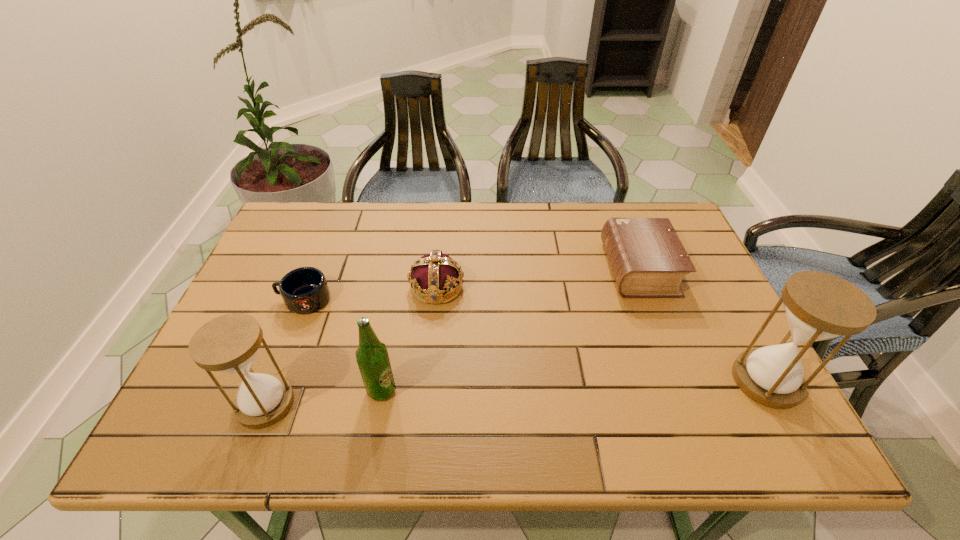
Find the location of `vacant space situated 0.260m on the left of the third shortest object`. vacant space situated 0.260m on the left of the third shortest object is located at coordinates (313, 287).

The image size is (960, 540). I want to click on vacant space positioned 0.360m on the spine side of the fifth tallest object, so click(x=479, y=269).

You are a GUI agent. You are given a task and a screenshot of the screen. Output one action in this format:
    pyautogui.click(x=<x>, y=<y>)
    Task: Click on the vacant space located on the spine side of the fifth tallest object
    Image resolution: width=960 pixels, height=540 pixels.
    Given the screenshot: What is the action you would take?
    pyautogui.click(x=521, y=269)

The image size is (960, 540). What are the coordinates of `blank space located 0.120m on the spine side of the fifth tallest object` in the screenshot? It's located at (564, 269).

Find the location of `free location located with the handle on the side of the shortest object`. free location located with the handle on the side of the shortest object is located at coordinates (255, 299).

Locate an element on the screen. This screenshot has height=540, width=960. free location located 0.100m with the handle on the side of the shortest object is located at coordinates (240, 299).

I want to click on free space located on the label of the beer bottle, so click(579, 390).

Locate an element on the screen. This screenshot has height=540, width=960. object located in the far edge section of the desktop is located at coordinates (648, 260).

Where is `beer bottle that is at the near edge`? Image resolution: width=960 pixels, height=540 pixels. beer bottle that is at the near edge is located at coordinates point(372,357).

At what (x,y) coordinates should I click in order to perform the action: click on hourglass at the left edge. Please return your answer as a coordinate pair (x, y). Looking at the image, I should click on tap(229, 343).